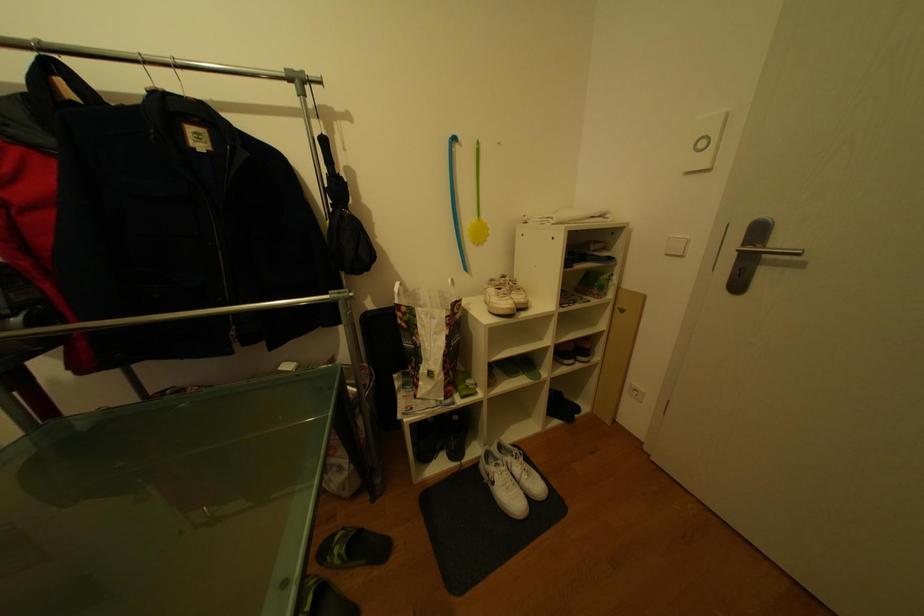
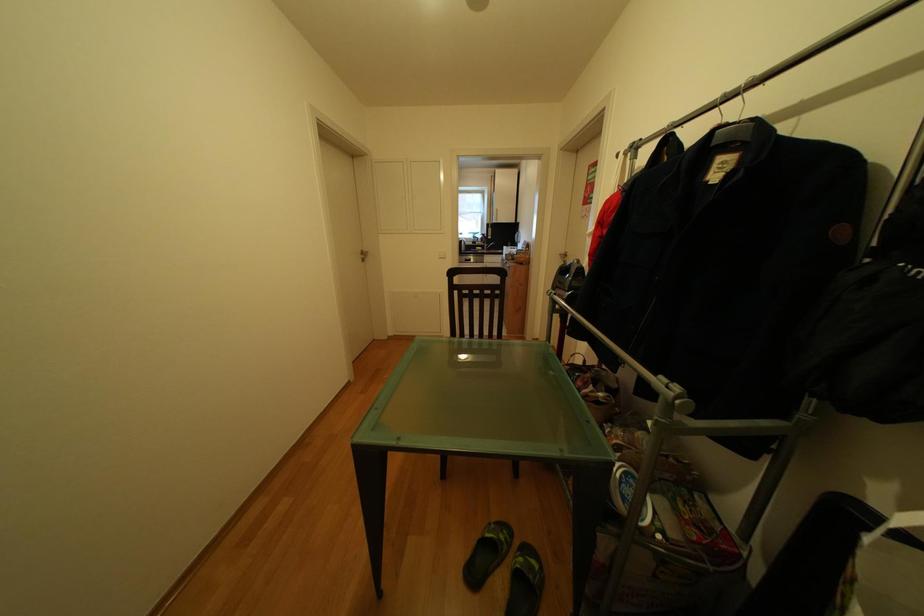
Based on the continuous images, in which direction is the camera rotating?

The camera rotated toward left-down.